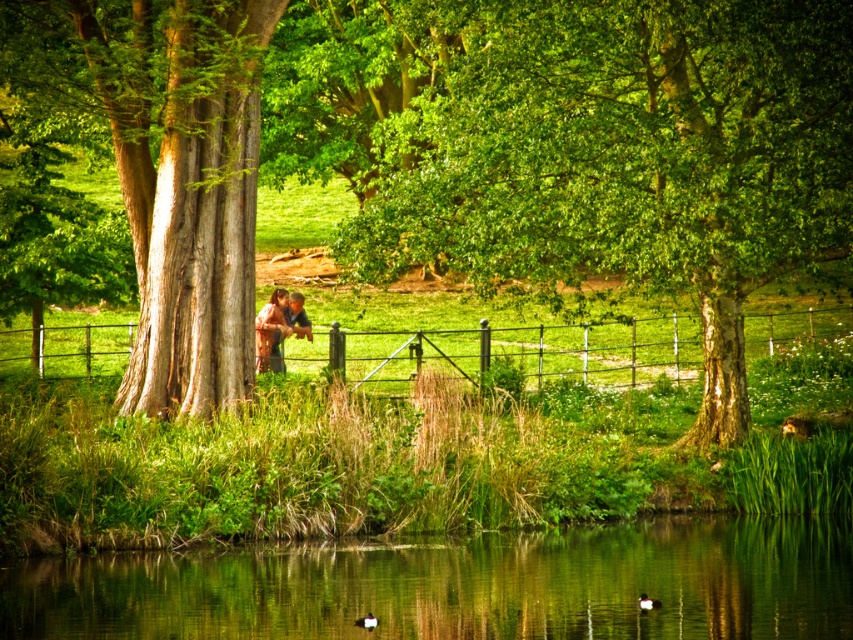
Question: Considering the relative positions of transparent water at lower center and smooth brown tree trunk at left in the image provided, where is transparent water at lower center located with respect to smooth brown tree trunk at left?

Choices:
 (A) right
 (B) left

Answer: (A)

Question: Which of the following is the closest to the observer?

Choices:
 (A) matte brown jacket at center
 (B) green leafy tree at center

Answer: (B)

Question: Can you confirm if transparent water at lower center is thinner than matte brown jacket at center?

Choices:
 (A) no
 (B) yes

Answer: (A)

Question: In this image, where is rustic wooden fence at center located relative to matte brown jacket at center?

Choices:
 (A) left
 (B) right

Answer: (B)

Question: Which object is farther from the camera taking this photo?

Choices:
 (A) rustic wooden fence at center
 (B) transparent water at lower center
 (C) matte brown jacket at center
 (D) green leafy tree at center

Answer: (C)

Question: Which object is the farthest from the rustic wooden fence at center?

Choices:
 (A) matte brown jacket at center
 (B) green leafy tree at center

Answer: (A)